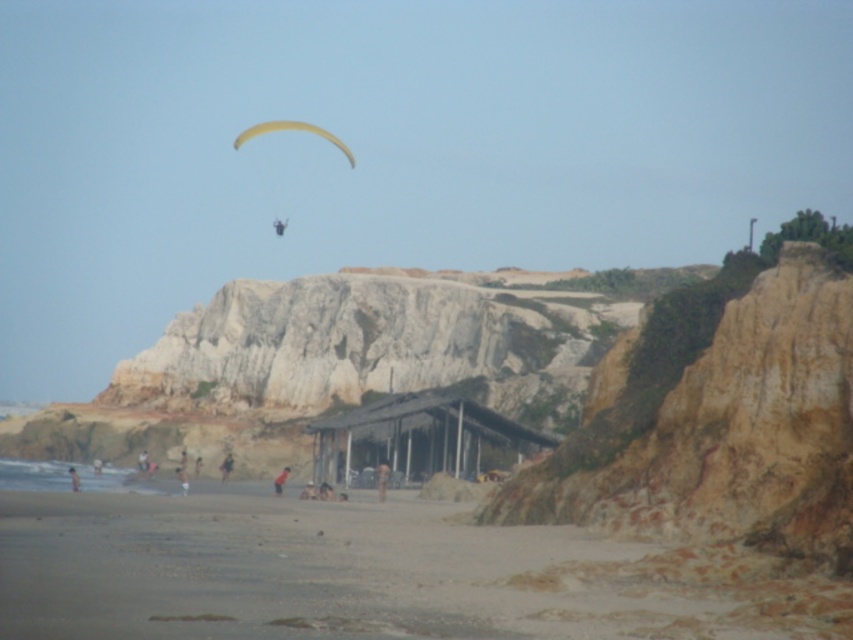
You are a hiker standing on the sandy beach at lower left and want to reach the light brown sand at lower center. Which direction should you move to get there?

Since the sandy beach at lower left is taller than the light brown sand at lower center, you should move downward towards the lower center direction to reach the light brown sand at lower center.

You are standing at the beach and want to reach the cliff face. You see two points marked as point 1 and point 2. Point 1 is at coordinate point (227, 477) and point 2 is at coordinate point (180, 468). Which point is closer to the cliff face?

Point 2 is closer to the cliff face because it is in front of point 1. Since point 1 is behind point 2, point 2 is nearer to the cliff face.